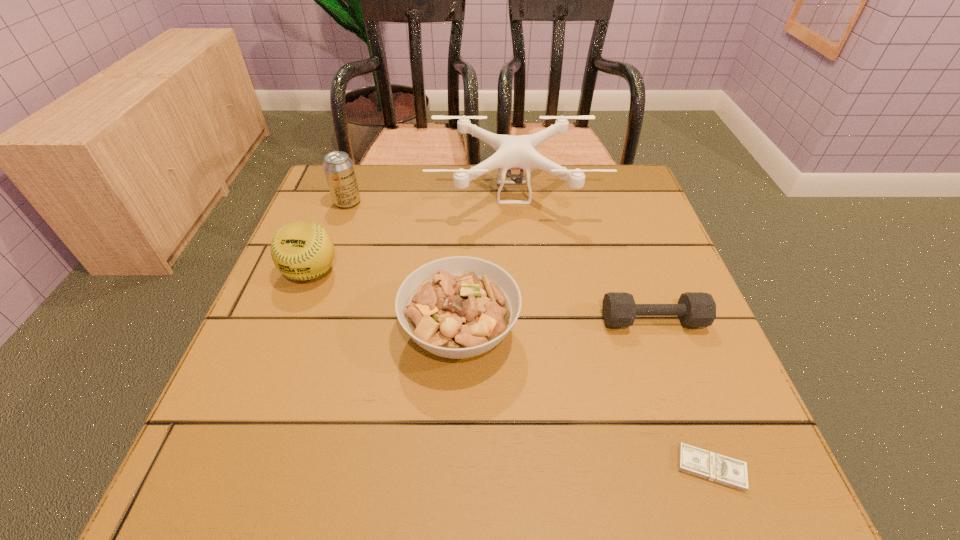
Image resolution: width=960 pixels, height=540 pixels. Find the location of `vacant area that lies between the beer can and the shortest object`. vacant area that lies between the beer can and the shortest object is located at coordinates (529, 335).

Where is `free spot between the drone and the shortest object`? This screenshot has width=960, height=540. free spot between the drone and the shortest object is located at coordinates (612, 330).

Find the location of a particular element. Image resolution: width=960 pixels, height=540 pixels. free space between the softball and the shortest object is located at coordinates (511, 370).

This screenshot has width=960, height=540. What are the coordinates of `vacant space that is in between the softball and the drone` in the screenshot? It's located at (412, 232).

Identify the location of vacant space that's between the softball and the drone. (412, 232).

What are the coordinates of `free point between the fifth tallest object and the beer can` in the screenshot? It's located at point(500,261).

The width and height of the screenshot is (960, 540). What are the coordinates of `object that is the second nearest to the beer can` in the screenshot? It's located at pyautogui.click(x=512, y=152).

At what (x,y) coordinates should I click in order to perform the action: click on the closest object to the third shortest object. Please return your answer as a coordinate pair (x, y). Looking at the image, I should click on 302,250.

I want to click on free location that satisfies the following two spatial constraints: 1. on the logo side of the shortest object; 2. on the right side of the softball, so click(235, 468).

Find the location of `vacant space that satisfies the following two spatial constraints: 1. on the logo side of the dumbbell; 2. on the left side of the softball`. vacant space that satisfies the following two spatial constraints: 1. on the logo side of the dumbbell; 2. on the left side of the softball is located at coordinates 292,320.